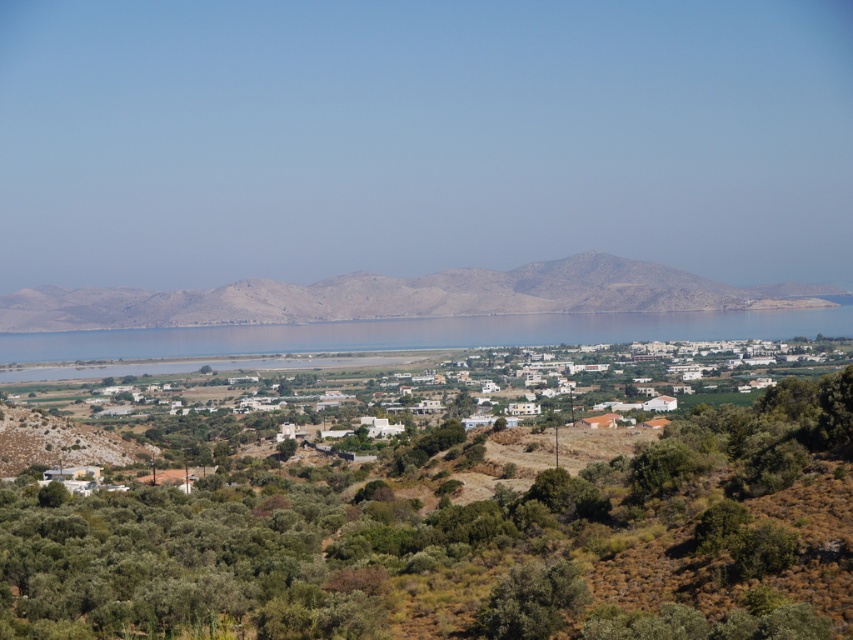
Describe the element at coordinates (354, 365) in the screenshot. I see `white matte houses at center` at that location.

Between point (55, 390) and point (259, 349), which one is positioned in front?

Point (259, 349) is more forward.

The height and width of the screenshot is (640, 853). What are the coordinates of `white matte houses at center` in the screenshot? It's located at (354, 365).

Is dull brown mountain at center to the left of blue water at center from the viewer's perspective?

Correct, you'll find dull brown mountain at center to the left of blue water at center.

Does dull brown mountain at center appear on the right side of blue water at center?

Incorrect, dull brown mountain at center is not on the right side of blue water at center.

Is point (265, 285) positioned after point (47, 356)?

No, it is not.

Find the location of `dull brown mountain at center`. dull brown mountain at center is located at coordinates (404, 296).

From the picture: Is white matte houses at center to the right of dull brown mountain at center from the viewer's perspective?

Correct, you'll find white matte houses at center to the right of dull brown mountain at center.

Which is in front, point (39, 364) or point (334, 305)?

Positioned in front is point (334, 305).

Measure the distance between point (416, 356) and camera.

A distance of 2105.95 feet exists between point (416, 356) and camera.

This screenshot has width=853, height=640. Find the location of `white matte houses at center`. white matte houses at center is located at coordinates (354, 365).